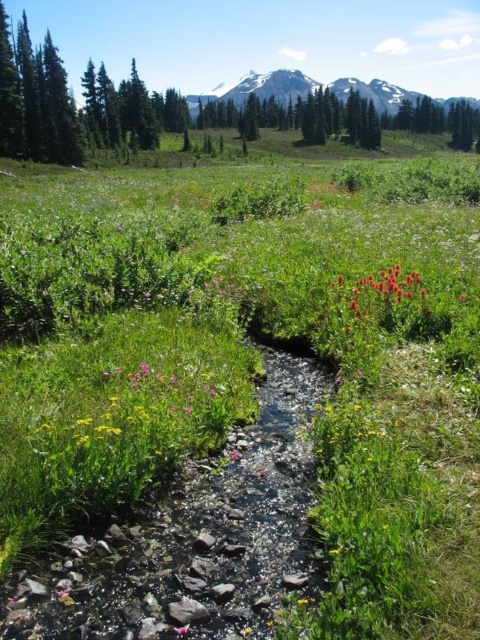
You are standing at the center of the meadow and want to pick the vivid crimson petals at center. According to the coordinates provided, in which direction should you move relative to your current position?

The vivid crimson petals at center are located at coordinates point (x=383, y=291), which means they are slightly to the right and forward from your current position at the center.

You are a hiker who wants to take a photo of the vivid crimson petals at center from the snowy granite mountain at upper center. Is the mountain positioned in a way that allows you to see the petals clearly without any obstructions?

The snowy granite mountain at upper center is located above the vivid crimson petals at center, so yes, the mountain is positioned above the petals, allowing you to see them clearly without any obstructions.

You are a hiker who wants to take a photo of the snowy granite mountain at upper center and the pink matte flower at center. How far apart are these two landmarks in meters?

The snowy granite mountain at upper center is 451.76 meters from the pink matte flower at center.